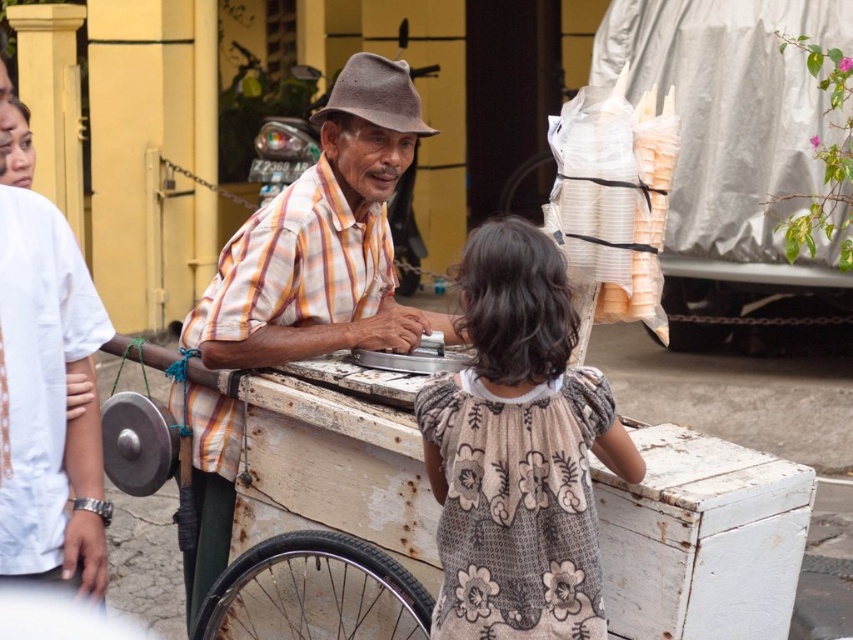
Question: Which point is farther to the camera?

Choices:
 (A) (306, 348)
 (B) (537, 424)
 (C) (606, 609)

Answer: (A)

Question: Based on their relative distances, which object is farther from the plaid shirt at center?

Choices:
 (A) floral-patterned dress at center
 (B) white weathered cart at center

Answer: (B)

Question: Does white weathered cart at center appear over floral-patterned dress at center?

Choices:
 (A) no
 (B) yes

Answer: (A)

Question: Which point appears farthest from the camera in this image?

Choices:
 (A) (276, 342)
 (B) (532, 541)

Answer: (A)

Question: Can you confirm if white weathered cart at center is smaller than plaid shirt at center?

Choices:
 (A) yes
 (B) no

Answer: (A)

Question: Can you confirm if white weathered cart at center is smaller than floral-patterned dress at center?

Choices:
 (A) yes
 (B) no

Answer: (B)